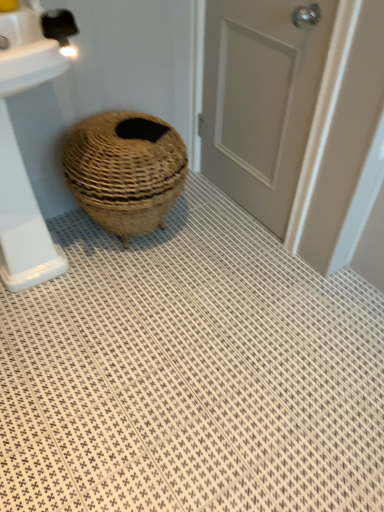
Image resolution: width=384 pixels, height=512 pixels. Find the location of `vacant region under white glossy sink at left (from a real-world perspective)`. vacant region under white glossy sink at left (from a real-world perspective) is located at coordinates (64, 272).